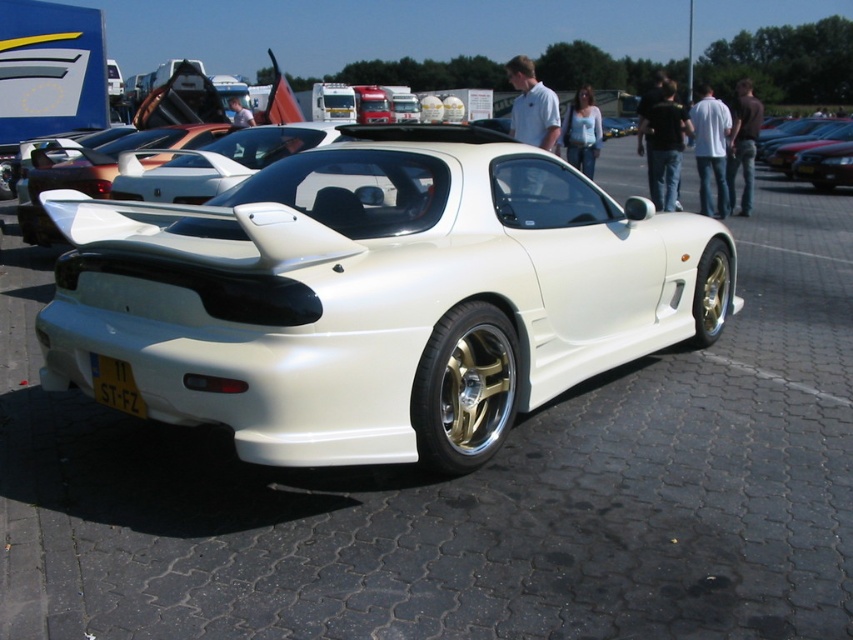
You are a photographer standing in front of the white metallic car at center and the yellow matte license plate at lower center. You want to take a photo that includes both objects in focus. Which object should you focus on to ensure both are sharp?

You should focus on the white metallic car at center because the yellow matte license plate at lower center is closer to the viewer than it, so focusing on the farther object will keep both in focus.

You are a photographer at a car show and need to capture a shot of the white metallic car at center without including its license plate. Based on their positions, which side should you avoid framing the shot to exclude the yellow matte license plate at lower center?

The yellow matte license plate at lower center is to the left of the white metallic car at center. To exclude it, avoid framing the shot from the left side of the white metallic car at center.